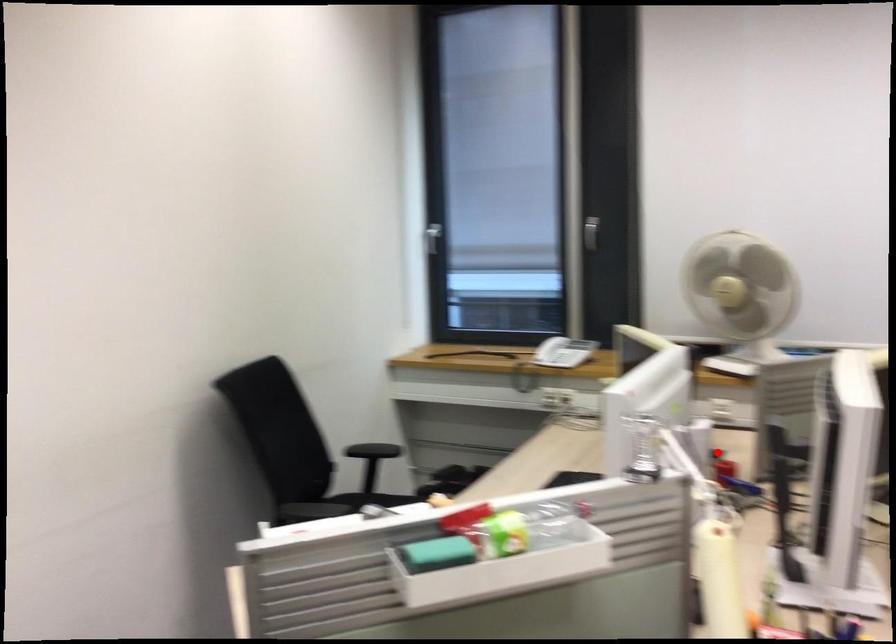
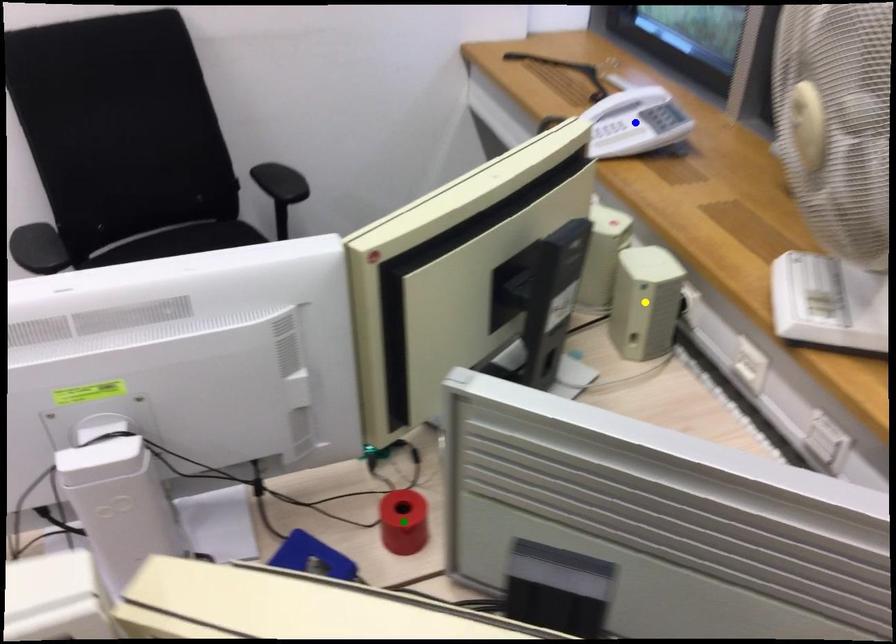
Question: I am providing you with two images of the same scene from different viewpoints. A red point is marked on the first image. You are given multiple points on the second image. In image 2, which mark is for the same physical point as the one in image 1?

Choices:
 (A) yellow point
 (B) blue point
 (C) green point

Answer: (C)